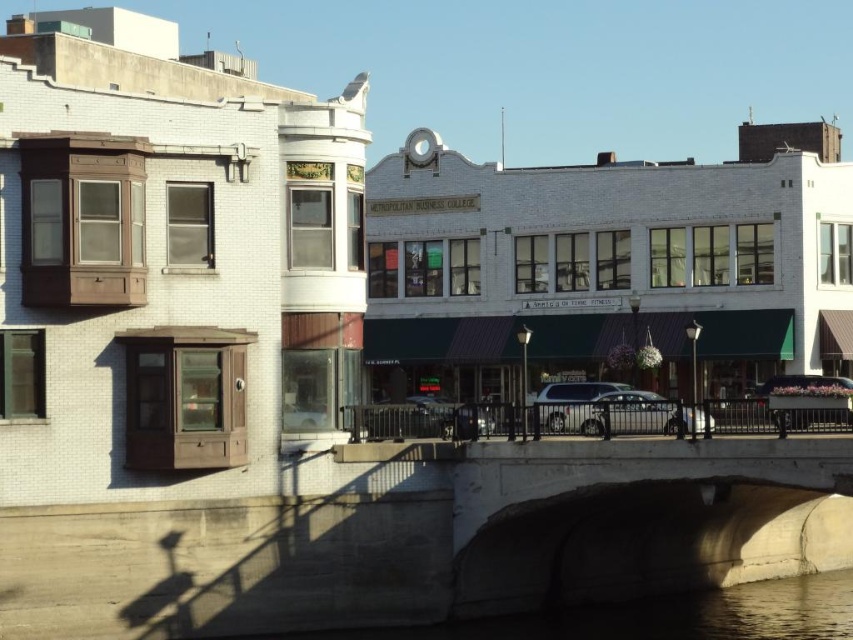
You are a pedestrian standing on the sidewalk and want to cross the street to reach the white brick building with curved facade on the left. There are two vehicles in the way at the center of the image, a silver metallic suv at center and a metallic silver car at center. Which vehicle is blocking your path closer to you?

The silver metallic suv at center is positioned under the metallic silver car at center, so the metallic silver car at center is closer to you and blocking your path.

You are standing at the point marked by the coordinates [612,410] in the image. Based on the scene description, what object is located at this point?

The point at coordinates [612,410] corresponds to the silver metallic suv at center.